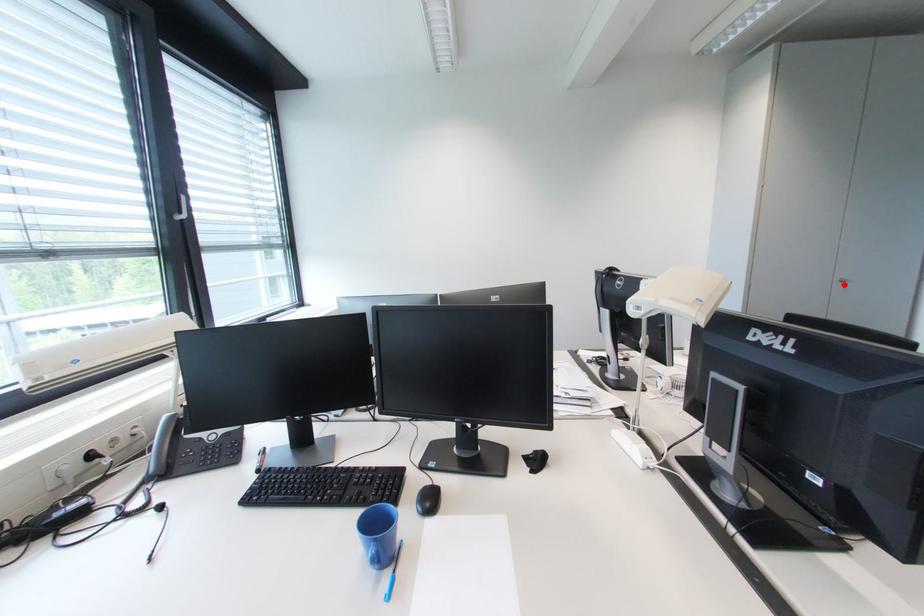
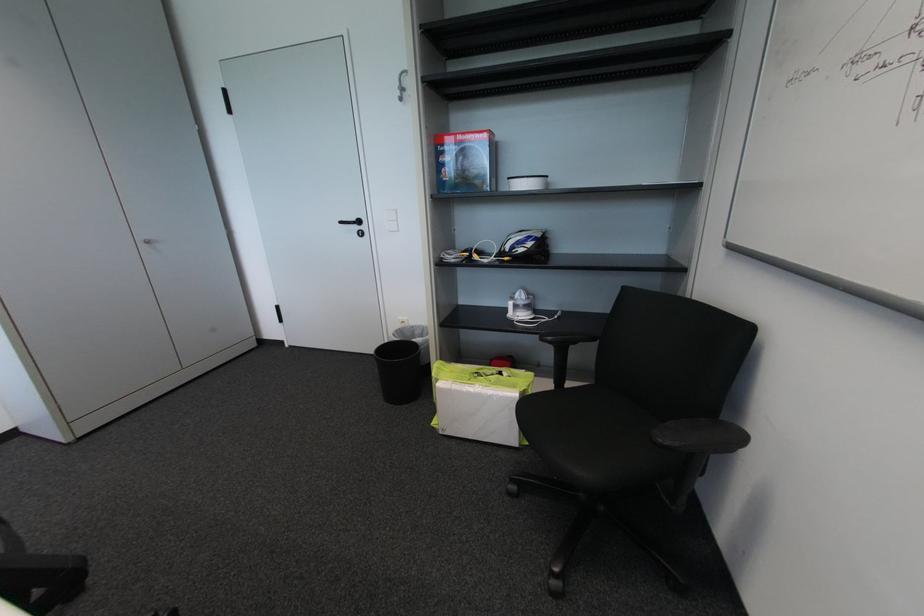
Find the pixel in the second image that matches the highlighted location in the first image.

(151, 246)